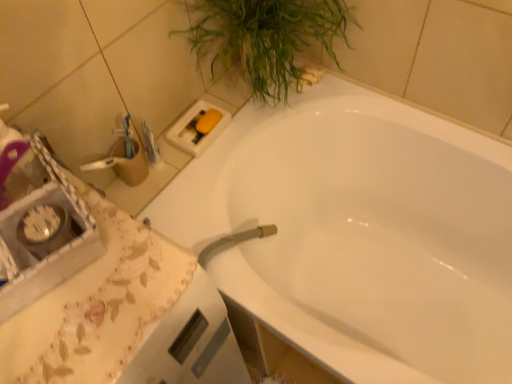
What is the approximate height of green leafy plant at upper right?

The height of green leafy plant at upper right is 38.61 centimeters.

Identify the location of white fabric at lower left. The image size is (512, 384). (96, 302).

Who is shorter, white fabric at lower left or white glossy bathtub at upper center?

With less height is white glossy bathtub at upper center.

Could you tell me if white fabric at lower left is facing white glossy bathtub at upper center?

No, white fabric at lower left is not facing towards white glossy bathtub at upper center.

How distant is white fabric at lower left from white glossy bathtub at upper center?

23.16 inches.

Is white glossy bathtub at upper center a part of white fabric at lower left?

Definitely not — white glossy bathtub at upper center is not inside white fabric at lower left.

Is green leafy plant at upper right to the right of white fabric at lower left from the viewer's perspective?

Yes.

From the picture: Is green leafy plant at upper right oriented away from white fabric at lower left?

No, green leafy plant at upper right is not facing the opposite direction of white fabric at lower left.

The height and width of the screenshot is (384, 512). I want to click on counter top below the green leafy plant at upper right (from the image's perspective), so click(96, 302).

Considering the relative sizes of green leafy plant at upper right and white fabric at lower left in the image provided, is green leafy plant at upper right bigger than white fabric at lower left?

Incorrect, green leafy plant at upper right is not larger than white fabric at lower left.

You are a GUI agent. You are given a task and a screenshot of the screen. Output one action in this format:
    pyautogui.click(x=<x>, y=<y>)
    Task: Click on the houseplant above the white fabric at lower left (from the image's perspective)
    The height and width of the screenshot is (384, 512).
    Given the screenshot: What is the action you would take?
    pyautogui.click(x=265, y=39)

From the image's perspective, which one is positioned higher, white fabric at lower left or green leafy plant at upper right?

green leafy plant at upper right, from the image's perspective.

Are white fabric at lower left and green leafy plant at upper right beside each other?

No, white fabric at lower left is not with green leafy plant at upper right.

Is white fabric at lower left situated inside green leafy plant at upper right or outside?

white fabric at lower left is not enclosed by green leafy plant at upper right.

Which of these two, white glossy bathtub at upper center or white fabric at lower left, is smaller?

white fabric at lower left is smaller.

Is white glossy bathtub at upper center in contact with white fabric at lower left?

No, white glossy bathtub at upper center is not with white fabric at lower left.

Between white glossy bathtub at upper center and white fabric at lower left, which one appears on the left side from the viewer's perspective?

From the viewer's perspective, white fabric at lower left appears more on the left side.

From the image's perspective, between white glossy bathtub at upper center and white fabric at lower left, which one is located above?

white glossy bathtub at upper center.

Is white glossy bathtub at upper center with green leafy plant at upper right?

white glossy bathtub at upper center and green leafy plant at upper right are clearly separated.

From a real-world perspective, which object stands above the other?

From a 3D spatial view, green leafy plant at upper right is above.

Considering the sizes of white glossy bathtub at upper center and green leafy plant at upper right in the image, is white glossy bathtub at upper center bigger or smaller than green leafy plant at upper right?

Considering their sizes, white glossy bathtub at upper center takes up more space than green leafy plant at upper right.

Is white glossy bathtub at upper center wider than green leafy plant at upper right?

Indeed, white glossy bathtub at upper center has a greater width compared to green leafy plant at upper right.

Is green leafy plant at upper right far away from white glossy bathtub at upper center?

No.

From a real-world perspective, which is physically above, green leafy plant at upper right or white glossy bathtub at upper center?

green leafy plant at upper right, from a real-world perspective.

This screenshot has width=512, height=384. I want to click on bathtub that appears on the right of green leafy plant at upper right, so click(x=360, y=233).

Does point (241, 41) come farther from viewer compared to point (387, 154)?

No, it is in front of (387, 154).

You are a GUI agent. You are given a task and a screenshot of the screen. Output one action in this format:
    pyautogui.click(x=<x>, y=<y>)
    Task: Click on the bathtub directly beneath the white fabric at lower left (from a real-world perspective)
    
    Given the screenshot: What is the action you would take?
    pyautogui.click(x=360, y=233)

Image resolution: width=512 pixels, height=384 pixels. What are the coordinates of `houseplant on the right of the white fabric at lower left` in the screenshot? It's located at (265, 39).

Considering their positions, is white glossy bathtub at upper center positioned closer to white fabric at lower left than green leafy plant at upper right?

Based on the image, white glossy bathtub at upper center appears to be nearer to white fabric at lower left.

Estimate the real-world distances between objects in this image. Which object is further from white glossy bathtub at upper center, white fabric at lower left or green leafy plant at upper right?

Based on the image, white fabric at lower left appears to be further to white glossy bathtub at upper center.

From the image, which object appears to be nearer to white fabric at lower left, green leafy plant at upper right or white glossy bathtub at upper center?

Among the two, white glossy bathtub at upper center is located nearer to white fabric at lower left.

From the image, which object appears to be nearer to green leafy plant at upper right, white glossy bathtub at upper center or white fabric at lower left?

Based on the image, white glossy bathtub at upper center appears to be nearer to green leafy plant at upper right.

From the picture: Based on their spatial positions, is white fabric at lower left or white glossy bathtub at upper center closer to green leafy plant at upper right?

white glossy bathtub at upper center lies closer to green leafy plant at upper right than the other object.

Estimate the real-world distances between objects in this image. Which object is closer to white glossy bathtub at upper center, green leafy plant at upper right or white fabric at lower left?

green leafy plant at upper right lies closer to white glossy bathtub at upper center than the other object.

Image resolution: width=512 pixels, height=384 pixels. Identify the location of bathtub between green leafy plant at upper right and white fabric at lower left in the up-down direction. (360, 233).